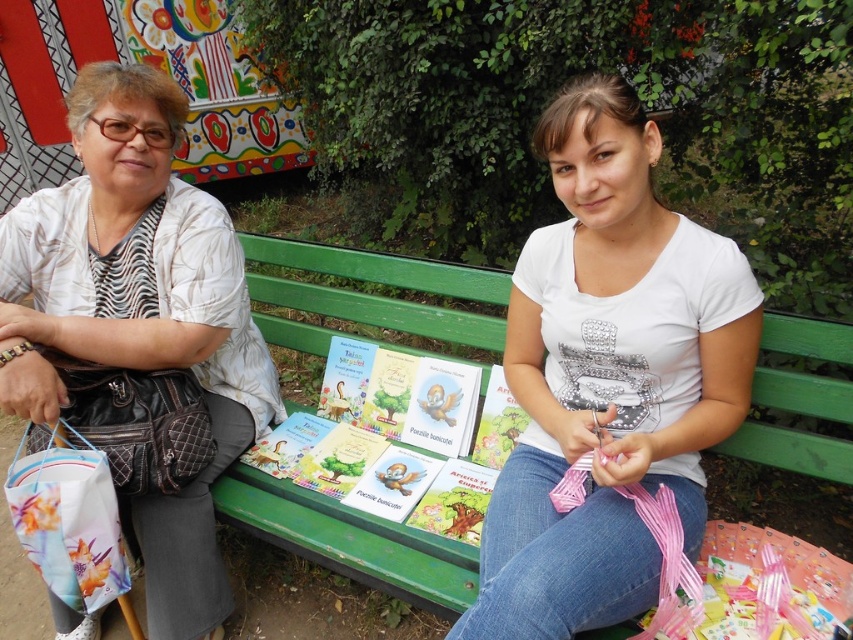
Based on the photo, based on the scene description, where is the white matte shirt located? Please provide coordinates in the format of a point like this example format point (608, 376). The scene has a green bench with two people. The person on the left has a black quilted handbag and a colorful shopping bag, while the person on the right is handling pink ribbons. The white matte shirt is part of one of their outfits. The answer must include the exact coordinates from the Objects Description.

The white matte shirt at center is located at point (608, 376).

What are the exact coordinates of the white matte shirt at center in the image?

The white matte shirt at center is located at coordinates point (608, 376).